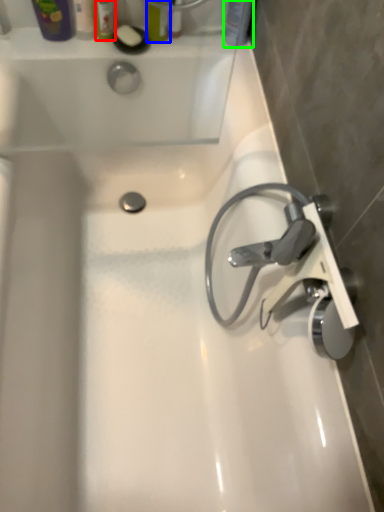
Question: Which object is the closest to the toiletry (highlighted by a red box)? Choose among these: toiletry (highlighted by a blue box) or toiletry (highlighted by a green box).

Choices:
 (A) toiletry
 (B) toiletry

Answer: (A)